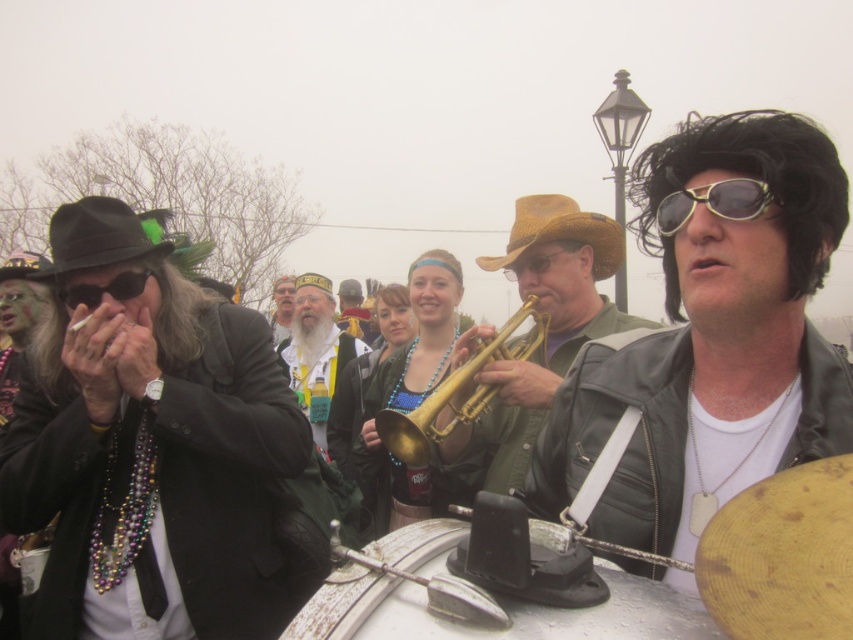
Locate an element on the screen. gold metallic trumpet at center is located at coordinates (540, 346).

Is gold metallic trumpet at center wider than gold brass trumpet at center?

Yes, gold metallic trumpet at center is wider than gold brass trumpet at center.

Does point (563, 300) come farther from viewer compared to point (451, 376)?

Yes, it is behind point (451, 376).

Locate an element on the screen. This screenshot has height=640, width=853. gold metallic trumpet at center is located at coordinates click(x=540, y=346).

Is shiny black suit at left to the right of matte black goggles at left from the viewer's perspective?

Yes, shiny black suit at left is to the right of matte black goggles at left.

Can you confirm if shiny black suit at left is positioned above matte black goggles at left?

No, shiny black suit at left is not above matte black goggles at left.

Is point (170, 326) farther from viewer compared to point (143, 282)?

That is True.

The image size is (853, 640). I want to click on shiny black suit at left, so click(x=149, y=449).

Is gold metallic trumpet at center to the left of shiny gold trumpet at center from the viewer's perspective?

Incorrect, gold metallic trumpet at center is not on the left side of shiny gold trumpet at center.

Between gold metallic trumpet at center and shiny gold trumpet at center, which one has less height?

shiny gold trumpet at center is shorter.

Does point (590, 212) come in front of point (355, 326)?

That is True.

What are the coordinates of `gold metallic trumpet at center` in the screenshot? It's located at (540, 346).